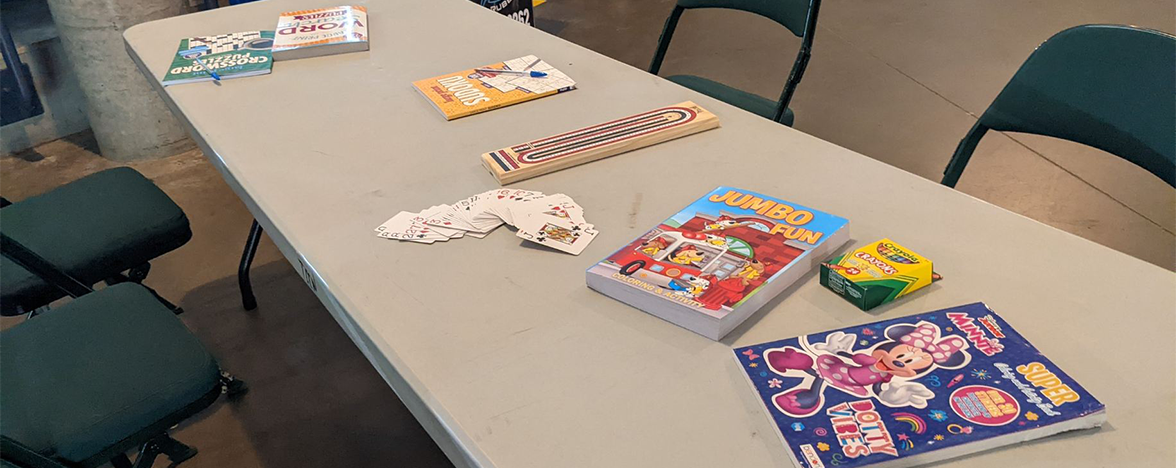
Find the location of a particular element. The height and width of the screenshot is (468, 1176). floor is located at coordinates (187, 188).